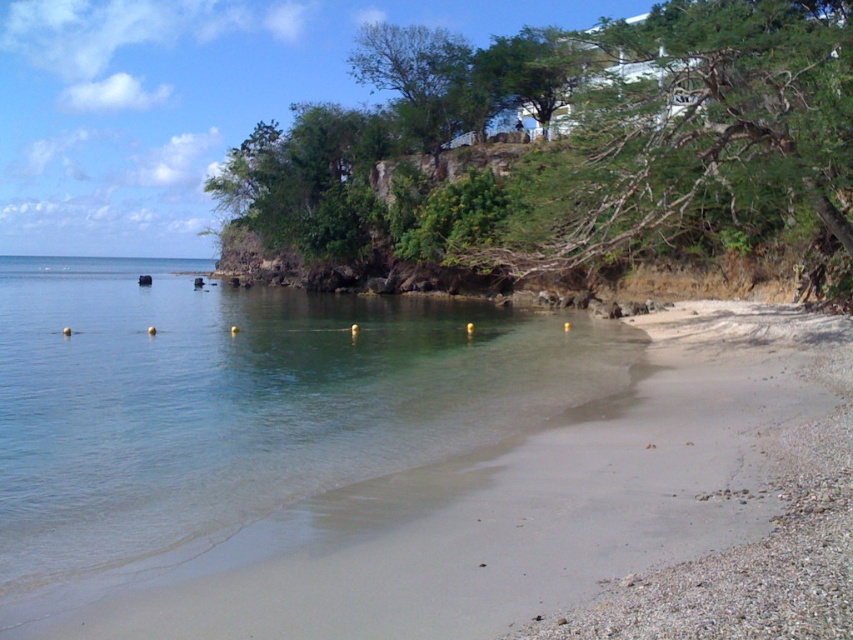
Question: Is clear water at lower left to the left of green leafy tree at upper center from the viewer's perspective?

Choices:
 (A) no
 (B) yes

Answer: (A)

Question: Which of the following is the closest to the observer?

Choices:
 (A) green leafy tree at upper center
 (B) clear water at lower left

Answer: (B)

Question: Observing the image, what is the correct spatial positioning of clear water at lower left in reference to green leafy tree at upper center?

Choices:
 (A) left
 (B) right

Answer: (B)

Question: Can you confirm if clear water at lower left is positioned below green leafy tree at upper center?

Choices:
 (A) yes
 (B) no

Answer: (A)